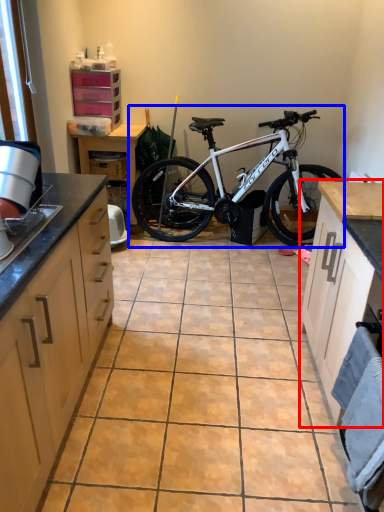
Question: Which point is closer to the camera, cabinetry (highlighted by a red box) or bicycle (highlighted by a blue box)?

Choices:
 (A) cabinetry
 (B) bicycle

Answer: (A)